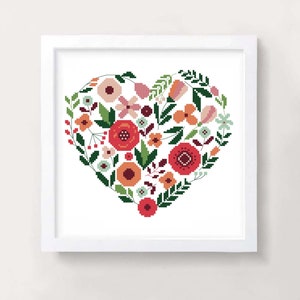
Locate an element on the screen. wall is located at coordinates (245, 265).